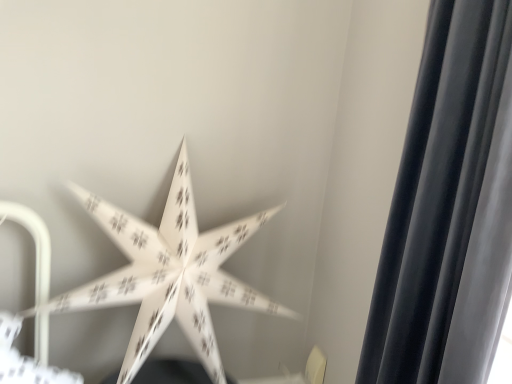
Image resolution: width=512 pixels, height=384 pixels. What do you see at coordinates (449, 209) in the screenshot?
I see `silky black curtain at right` at bounding box center [449, 209].

Locate an element on the screen. silky black curtain at right is located at coordinates (449, 209).

In order to face silky black curtain at right, should I rotate leftwards or rightwards?

Result: You should look right and rotate roughly 22.699 degrees.

At what (x,y) coordinates should I click in order to perform the action: click on white paper star at center. Please return your answer as a coordinate pair (x, y). Looking at the image, I should click on (169, 273).

This screenshot has height=384, width=512. What do you see at coordinates (169, 273) in the screenshot? I see `white paper star at center` at bounding box center [169, 273].

Where is `silky black curtain at right`? silky black curtain at right is located at coordinates (449, 209).

Considering the positions of objects white paper star at center and silky black curtain at right in the image provided, who is more to the right, white paper star at center or silky black curtain at right?

silky black curtain at right.

Considering the positions of objects white paper star at center and silky black curtain at right in the image provided, who is behind, white paper star at center or silky black curtain at right?

white paper star at center is more distant.

Which point is more distant from viewer, (x=211, y=296) or (x=485, y=178)?

The point (x=211, y=296) is farther.

From the image's perspective, is white paper star at center below silky black curtain at right?

Yes, from the image's perspective, white paper star at center is below silky black curtain at right.

From a real-world perspective, is white paper star at center physically above silky black curtain at right?

No, from a real-world perspective, white paper star at center is not over silky black curtain at right

Which of these two, white paper star at center or silky black curtain at right, is thinner?

Thinner between the two is silky black curtain at right.

Which of these two, white paper star at center or silky black curtain at right, stands shorter?

With less height is white paper star at center.

Considering the relative sizes of white paper star at center and silky black curtain at right in the image provided, is white paper star at center bigger than silky black curtain at right?

Yes, white paper star at center is bigger than silky black curtain at right.

Is white paper star at center completely or partially outside of silky black curtain at right?

That's correct, white paper star at center is outside of silky black curtain at right.

From the picture: Is white paper star at center beside silky black curtain at right?

No, white paper star at center is not next to silky black curtain at right.

Looking at this image, is white paper star at center turned away from silky black curtain at right?

No, silky black curtain at right is not at the back of white paper star at center.

Can you tell me how much white paper star at center and silky black curtain at right differ in facing direction?

The angle between the facing direction of white paper star at center and the facing direction of silky black curtain at right is 87.8 degrees.

Image resolution: width=512 pixels, height=384 pixels. I want to click on curtain that is above the white paper star at center (from the image's perspective), so click(449, 209).

Which object is positioned more to the right, silky black curtain at right or white paper star at center?

Positioned to the right is silky black curtain at right.

Who is more distant, silky black curtain at right or white paper star at center?

white paper star at center.

Which is in front, point (463, 102) or point (157, 245)?

The point (463, 102) is closer to the camera.

From the image's perspective, which one is positioned lower, silky black curtain at right or white paper star at center?

white paper star at center is shown below in the image.

From a real-world perspective, is silky black curtain at right above or below white paper star at center?

From a real-world perspective, silky black curtain at right is physically above white paper star at center.

Considering the sizes of objects silky black curtain at right and white paper star at center in the image provided, who is thinner, silky black curtain at right or white paper star at center?

Thinner between the two is silky black curtain at right.

Considering the sizes of objects silky black curtain at right and white paper star at center in the image provided, who is shorter, silky black curtain at right or white paper star at center?

Standing shorter between the two is white paper star at center.

Is silky black curtain at right smaller than white paper star at center?

Correct, silky black curtain at right occupies less space than white paper star at center.

Would you say silky black curtain at right is outside white paper star at center?

silky black curtain at right is positioned outside white paper star at center.

Based on the photo, are silky black curtain at right and white paper star at center far apart?

silky black curtain at right is near white paper star at center, not far away.

Could you tell me if silky black curtain at right is turned towards white paper star at center?

No.

Locate an element on the screen. The width and height of the screenshot is (512, 384). star below the silky black curtain at right (from the image's perspective) is located at coordinates (169, 273).

The width and height of the screenshot is (512, 384). I want to click on star to the left of silky black curtain at right, so click(169, 273).

Where is `star below the silky black curtain at right (from the image's perspective)`? This screenshot has width=512, height=384. star below the silky black curtain at right (from the image's perspective) is located at coordinates (169, 273).